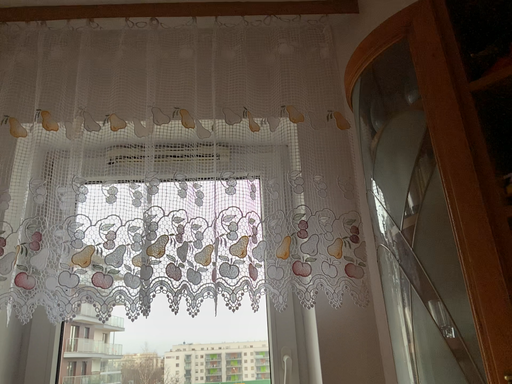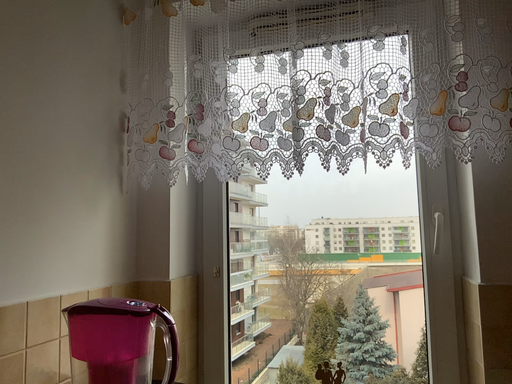
Question: How did the camera likely rotate when shooting the video?

Choices:
 (A) rotated right
 (B) rotated left

Answer: (B)